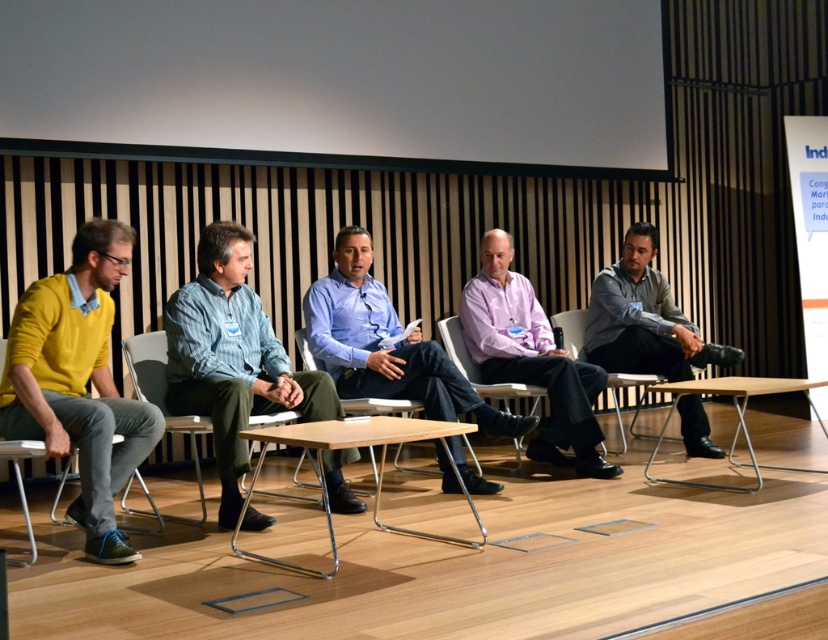
Between matte yellow sweater at left and blue striped shirt at center, which one appears on the left side from the viewer's perspective?

From the viewer's perspective, matte yellow sweater at left appears more on the left side.

Who is positioned more to the right, matte yellow sweater at left or blue striped shirt at center?

blue striped shirt at center

Describe the element at coordinates (78, 381) in the screenshot. The width and height of the screenshot is (828, 640). I see `matte yellow sweater at left` at that location.

What are the coordinates of `matte yellow sweater at left` in the screenshot? It's located at (78, 381).

Who is lower down, light brown wood table at lower right or wooden at center?

light brown wood table at lower right is lower down.

Who is positioned more to the right, light brown wood table at lower right or wooden at center?

light brown wood table at lower right

Describe the element at coordinates (735, 416) in the screenshot. The width and height of the screenshot is (828, 640). I see `light brown wood table at lower right` at that location.

The image size is (828, 640). Identify the location of light brown wood table at lower right. (735, 416).

Between point (94, 472) and point (299, 332), which one is positioned behind?

Positioned behind is point (299, 332).

Who is more forward, (x=25, y=396) or (x=472, y=492)?

Positioned in front is point (x=25, y=396).

Identify the location of matte yellow sweater at left. This screenshot has height=640, width=828. (78, 381).

Find the location of a particular element. This screenshot has height=640, width=828. matte yellow sweater at left is located at coordinates (78, 381).